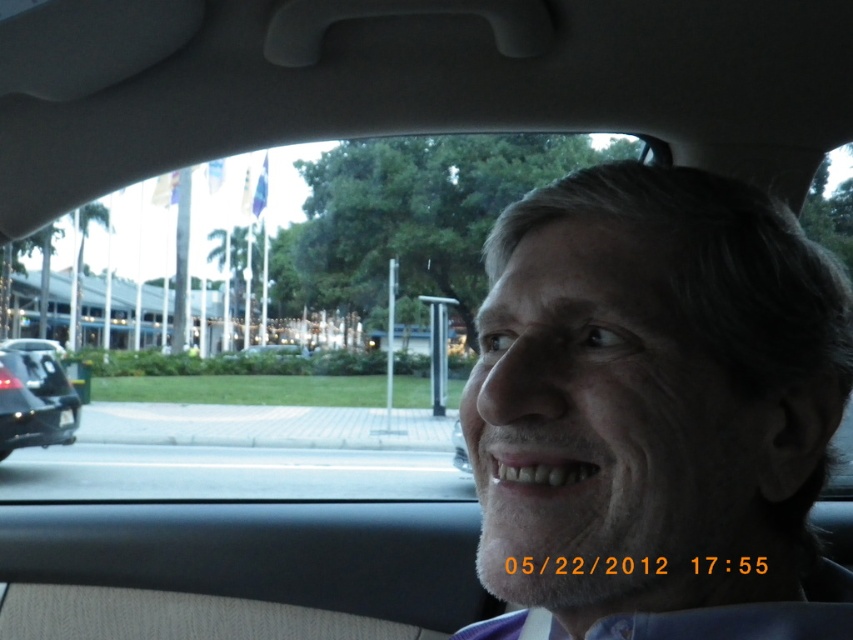
You are sitting in the passenger seat of the car and looking out the windshield. There are two points marked on the windshield at coordinates point(830, 634) and point(9, 429). Which point is closer to you?

Point(830, 634) is in front of point(9, 429), so the point closer to you is point(9, 429).

Based on the photo, you are a passenger in the car and notice two objects outside through the windshield. One is the gray matte face at center and the other is the black glossy car at left. Which object is positioned higher relative to the other?

The gray matte face at center is located above the black glossy car at left.